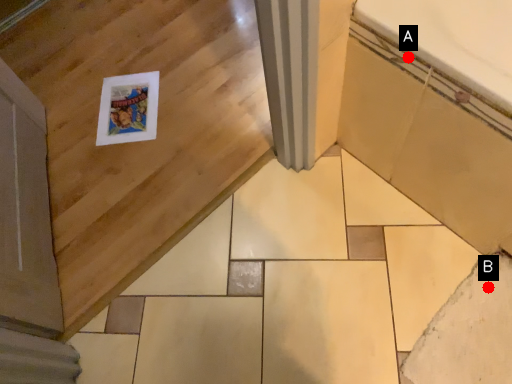
Question: Two points are circled on the image, labeled by A and B beside each circle. Which point is closer to the camera?

Choices:
 (A) A is closer
 (B) B is closer

Answer: (A)